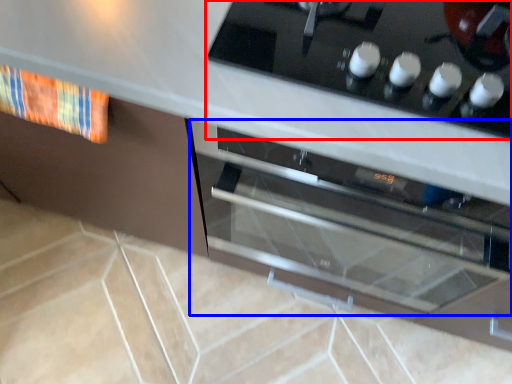
Question: Which of the following is the closest to the observer, home appliance (highlighted by a red box) or oven (highlighted by a blue box)?

Choices:
 (A) home appliance
 (B) oven

Answer: (A)